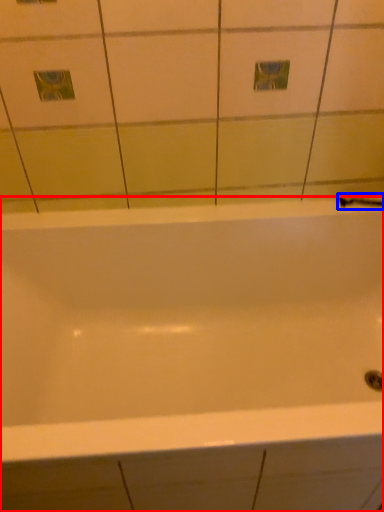
Question: Among these objects, which one is farthest to the camera, bathtub (highlighted by a red box) or shower (highlighted by a blue box)?

Choices:
 (A) bathtub
 (B) shower

Answer: (B)